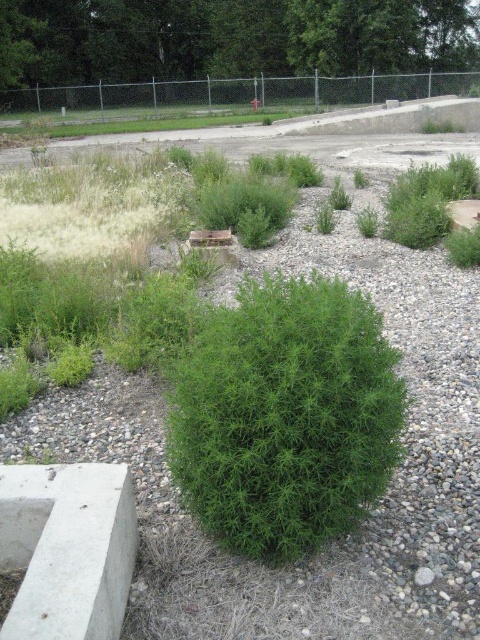
You are a gardener planning to plant a new flower bed between the green leafy shrub at center and the green leafy bush at center. Which of the two plants has a wider base to accommodate the flower bed?

The green leafy bush at center has a wider base compared to the green leafy shrub at center, so it can accommodate the flower bed better.

Looking at this image, you are a gardener looking at the landscaped area. You see the green leafy shrub at center and the green leafy bush at center. Which one is located to the right of the other?

The green leafy shrub at center is positioned on the right side of the green leafy bush at center.

You are a gardener who wants to plant a new flower bed between the green leafy shrub at center and the green leafy bush at center. Which object should you dig around to create space for the flowers?

You should dig around the green leafy shrub at center because it is positioned under the green leafy bush at center, so creating space there would be more feasible without disturbing the upper plant.